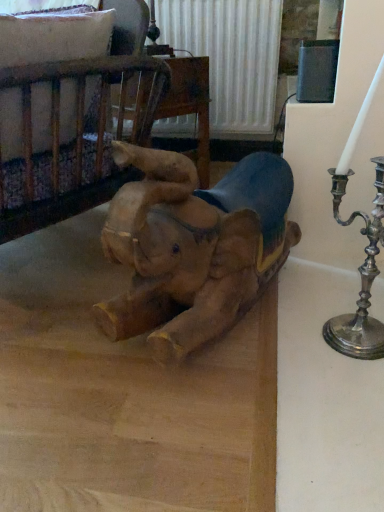
Question: Visually, is wooden elephant at center positioned to the left or to the right of wooden crib at upper left?

Choices:
 (A) left
 (B) right

Answer: (B)

Question: Looking at the image, does wooden elephant at center seem bigger or smaller compared to wooden crib at upper left?

Choices:
 (A) small
 (B) big

Answer: (B)

Question: Estimate the real-world distances between objects in this image. Which object is farther from the wooden elephant at center?

Choices:
 (A) wooden elephant at center
 (B) wooden crib at upper left

Answer: (B)

Question: Estimate the real-world distances between objects in this image. Which object is farther from the wooden elephant at center?

Choices:
 (A) wooden elephant at center
 (B) wooden crib at upper left

Answer: (B)